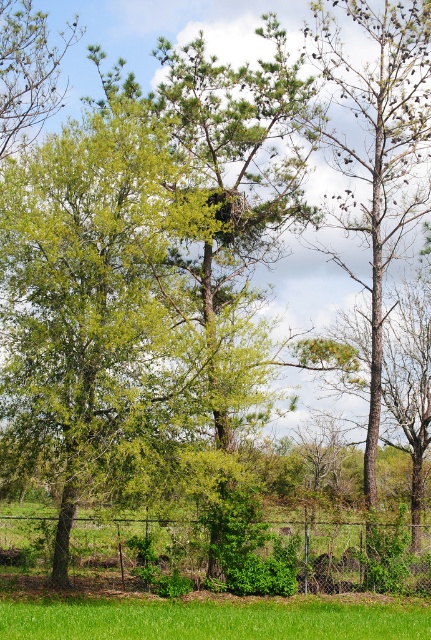
Question: Which is nearer to the chain link fence at lower center?

Choices:
 (A) green leafy tree at upper left
 (B) green grass at lower center

Answer: (B)

Question: Is chain link fence at lower center wider than green grass at lower center?

Choices:
 (A) yes
 (B) no

Answer: (B)

Question: Which object appears closest to the camera in this image?

Choices:
 (A) green leafy tree at upper left
 (B) chain link fence at lower center
 (C) green grass at lower center

Answer: (C)

Question: Considering the relative positions of chain link fence at lower center and green leafy tree at upper left in the image provided, where is chain link fence at lower center located with respect to green leafy tree at upper left?

Choices:
 (A) left
 (B) right

Answer: (B)

Question: Among these points, which one is nearest to the camera?

Choices:
 (A) (234, 605)
 (B) (112, 586)

Answer: (A)

Question: Is the position of green grass at lower center less distant than that of green leafy tree at upper left?

Choices:
 (A) yes
 (B) no

Answer: (A)